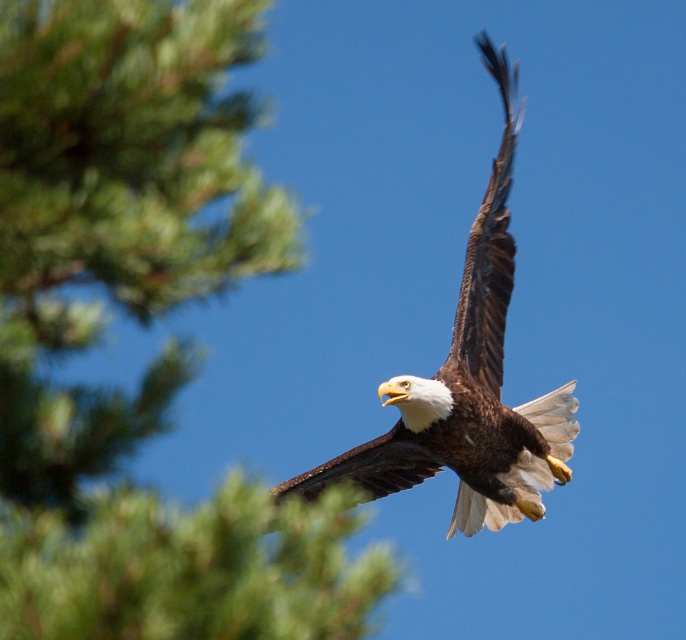
You are a photographer trying to capture the brown feathered eagle at center and the green textured pine tree at upper left in your shot. Which object will appear narrower in the photo?

The green textured pine tree at upper left will appear narrower in the photo because it is thinner than the brown feathered eagle at center according to the description.

You are a photographer trying to capture the brown feathered eagle at center against the sky. You notice the green textured pine tree at upper left might be in the frame. Based on their sizes, which object would appear larger in your photo?

The brown feathered eagle at center appears larger in the photo because the green textured pine tree at upper left has a smaller size compared to it.

You are a photographer trying to capture the brown feathered eagle at center while ensuring the green textured pine tree at upper left is also in the frame. Based on their positions, which object should you focus on to keep both in sharp focus?

The photographer should focus on the green textured pine tree at upper left because it is closer to the viewer than the brown feathered eagle at center, allowing both to be in focus when using a suitable depth of field.